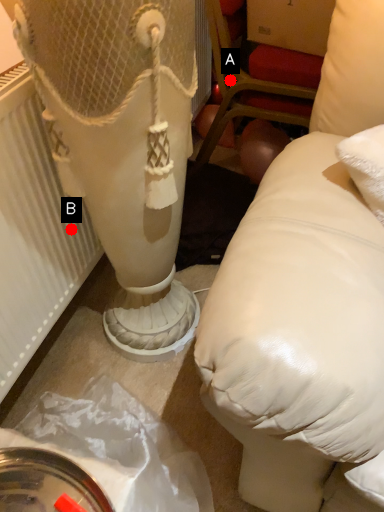
Question: Two points are circled on the image, labeled by A and B beside each circle. Which point appears farthest from the camera in this image?

Choices:
 (A) A is further
 (B) B is further

Answer: (A)